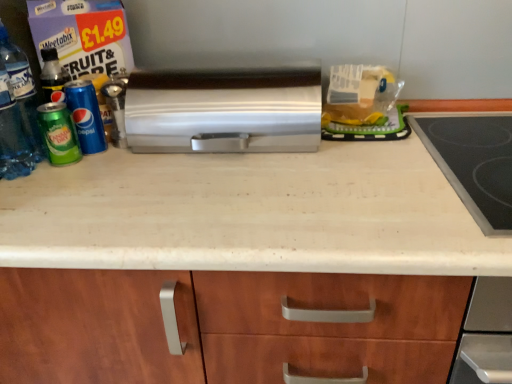
Where is `vacant area that lies to the right of translucent plastic bottle at left`? The height and width of the screenshot is (384, 512). vacant area that lies to the right of translucent plastic bottle at left is located at coordinates (103, 175).